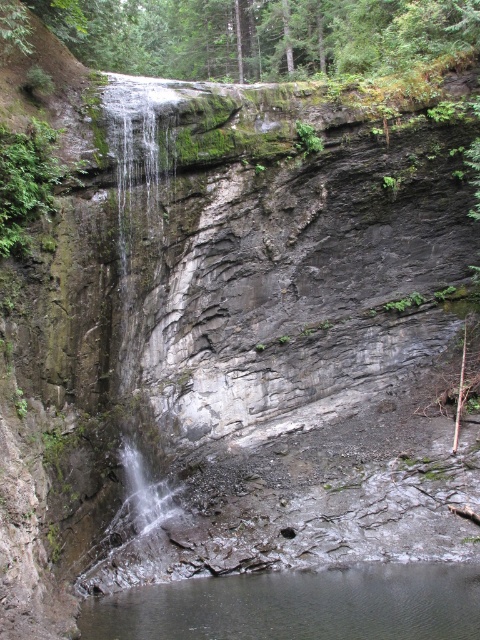
You are a kayaker planning to navigate through the clear water at lower center and the clear water at center. The kayak requires a minimum of 7 meters of space between the two water sections to safely pass. Based on the scene, can you determine if there is enough space for your kayak?

The clear water at lower center is 6.72 meters from clear water at center, which is less than the required 7 meters. Therefore, there is not enough space for the kayak to safely pass.

You are standing at the edge of the pool and want to cross to the other side. You see two areas of clear water, the clear water at lower center and the clear water at center. Which area is more to the right side?

The clear water at lower center is positioned on the right side of clear water at center.

You are standing at the edge of the cliff and want to observe both the clear water at lower center and the clear water at center. Which one is larger in size?

The clear water at center is larger than the clear water at lower center.